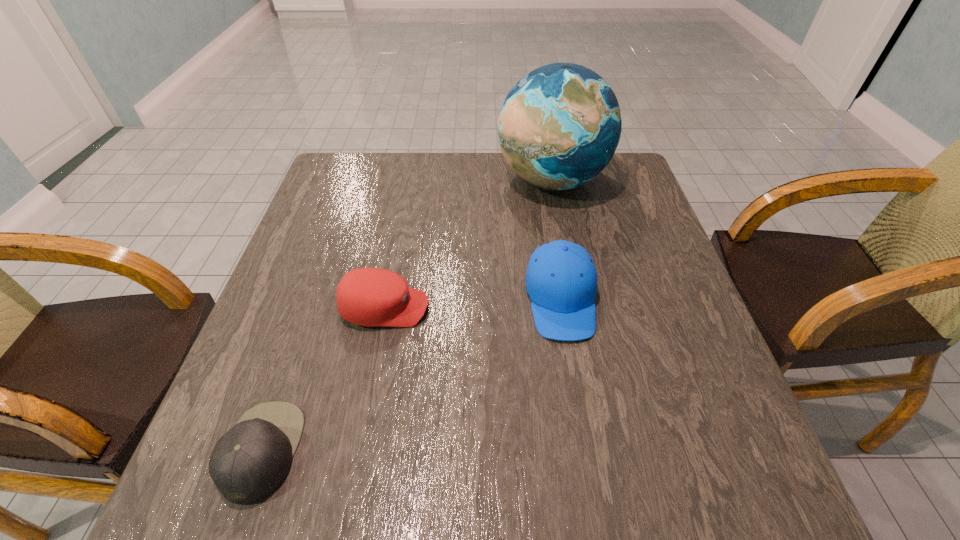
Locate an element on the screen. free space at the far left corner of the desktop is located at coordinates pos(336,169).

This screenshot has height=540, width=960. Identify the location of free space at the near right corner of the desktop. (671, 460).

Locate an element on the screen. This screenshot has height=540, width=960. free area in between the leftmost object and the third shortest object is located at coordinates (412, 375).

Where is `blank region between the second cap from right to left and the farthest object`? This screenshot has width=960, height=540. blank region between the second cap from right to left and the farthest object is located at coordinates (468, 245).

Locate an element on the screen. empty space between the nearest object and the second object from left to right is located at coordinates (324, 379).

You are a GUI agent. You are given a task and a screenshot of the screen. Output one action in this format:
    pyautogui.click(x=<x>, y=<y>)
    Task: Click on the free space between the second cap from right to left and the globe
    
    Given the screenshot: What is the action you would take?
    pyautogui.click(x=468, y=245)

I want to click on free area in between the nearest cap and the rightmost cap, so click(x=412, y=375).

Where is `vacant area that lies between the third object from right to left and the tallest object`? This screenshot has width=960, height=540. vacant area that lies between the third object from right to left and the tallest object is located at coordinates (468, 245).

Find the location of a particular element. free space that is in between the tallest object and the third object from right to left is located at coordinates (468, 245).

Where is `free space between the second cap from right to left and the globe`? free space between the second cap from right to left and the globe is located at coordinates (468, 245).